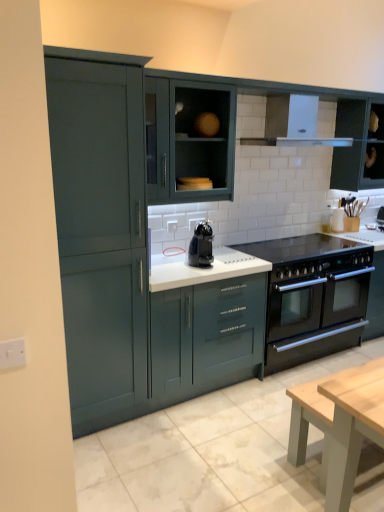
This screenshot has width=384, height=512. In order to click on free spot to the left of black glossy coffee machine at center in this screenshot , I will do `click(185, 264)`.